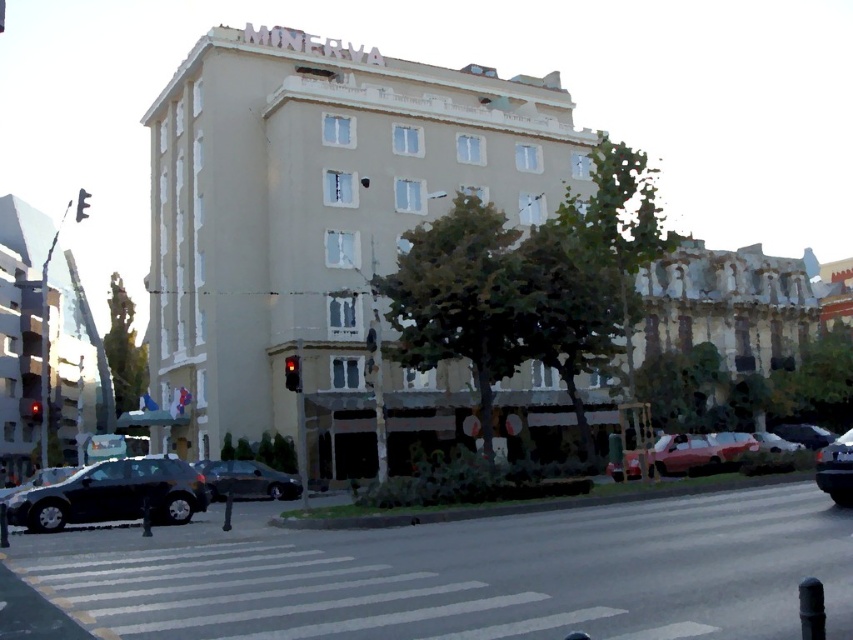
Question: Which point appears closest to the camera in this image?

Choices:
 (A) (164, 472)
 (B) (210, 470)

Answer: (A)

Question: Which point is closer to the camera?

Choices:
 (A) red glass traffic light at center
 (B) shiny black car at lower right

Answer: (B)

Question: Does black asphalt road at lower center have a greater width compared to red glass traffic light at center?

Choices:
 (A) yes
 (B) no

Answer: (A)

Question: Which of the following is the farthest from the observer?

Choices:
 (A) red glass traffic light at center
 (B) beige concrete building at center
 (C) red glass traffic light at left
 (D) black asphalt road at lower center

Answer: (C)

Question: Does satin black sedan at center come behind red glass traffic light at center?

Choices:
 (A) no
 (B) yes

Answer: (B)

Question: Is red glass traffic light at center to the left of red glass traffic light at left from the viewer's perspective?

Choices:
 (A) no
 (B) yes

Answer: (A)